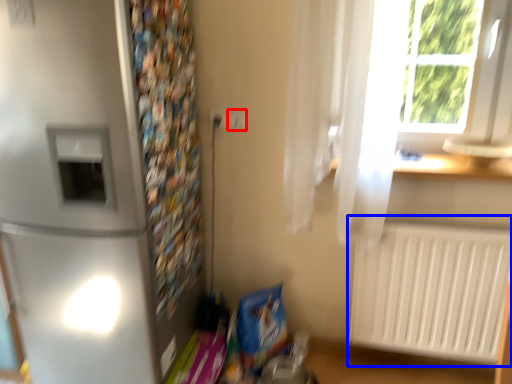
Question: Which object is closer to the camera taking this photo, electric outlet (highlighted by a red box) or radiator (highlighted by a blue box)?

Choices:
 (A) electric outlet
 (B) radiator

Answer: (B)